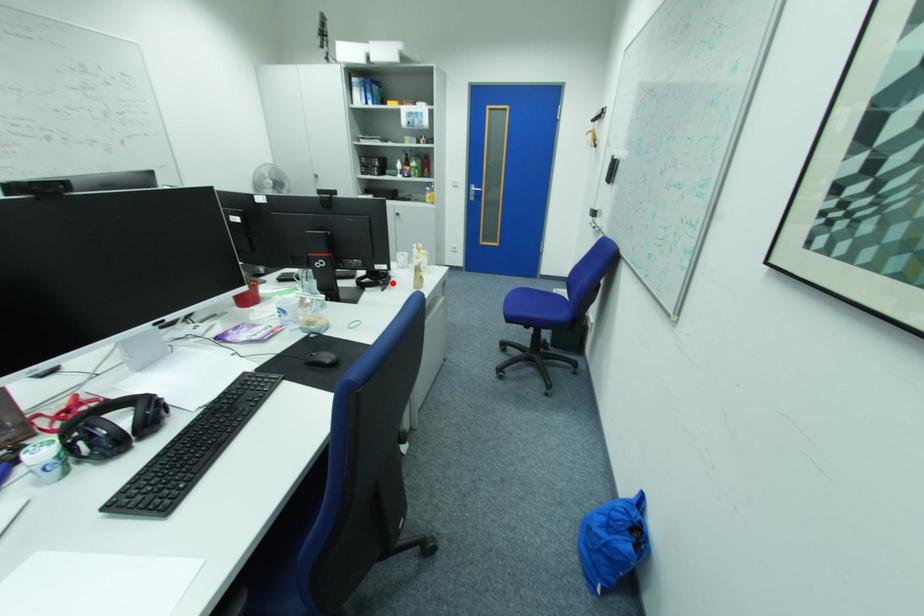
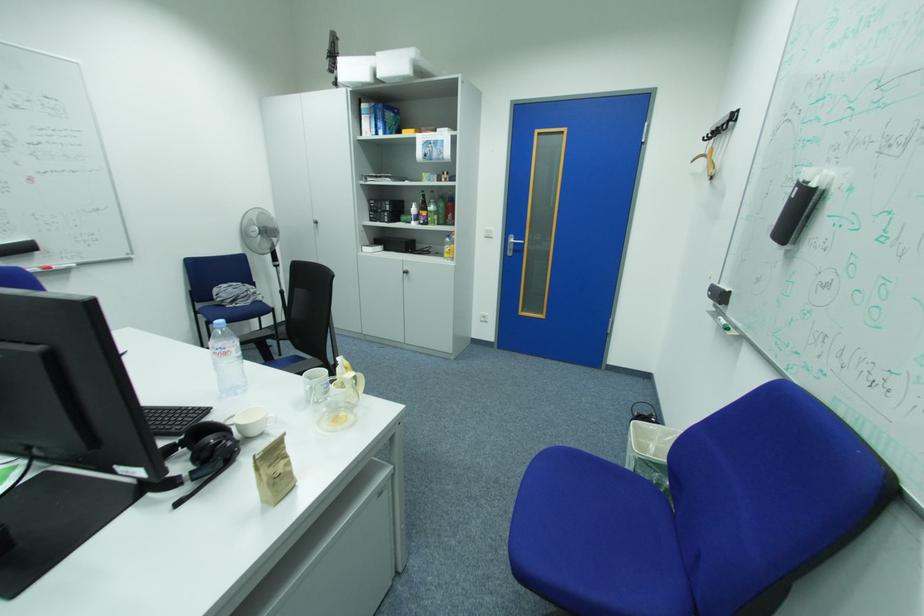
Find the pixel in the second image that matches the highlighted location in the first image.

(203, 476)